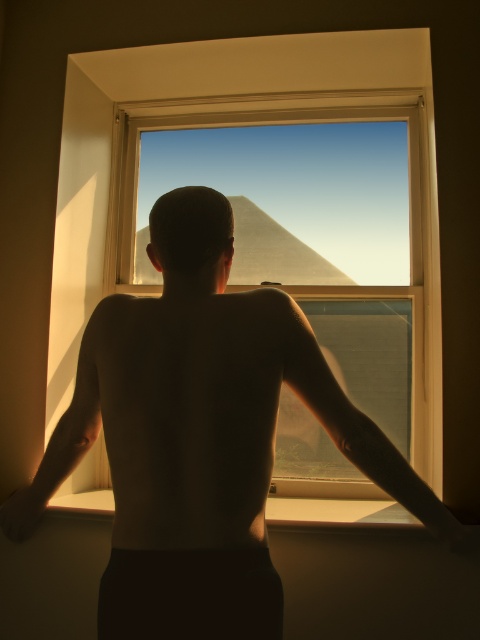
Question: Is smooth skin at center thinner than satin skin arm at center?

Choices:
 (A) yes
 (B) no

Answer: (B)

Question: Can you confirm if clear glass window at center is positioned to the left of satin skin arm at center?

Choices:
 (A) no
 (B) yes

Answer: (B)

Question: Does clear glass window at center appear under satin skin arm at center?

Choices:
 (A) no
 (B) yes

Answer: (A)

Question: Which object is farther from the camera taking this photo?

Choices:
 (A) satin skin arm at center
 (B) clear glass window at center

Answer: (B)

Question: Which point is farther to the camera?

Choices:
 (A) smooth skin at center
 (B) smooth skin arm at left

Answer: (B)

Question: Which object appears farthest from the camera in this image?

Choices:
 (A) smooth skin arm at left
 (B) satin skin arm at center

Answer: (A)